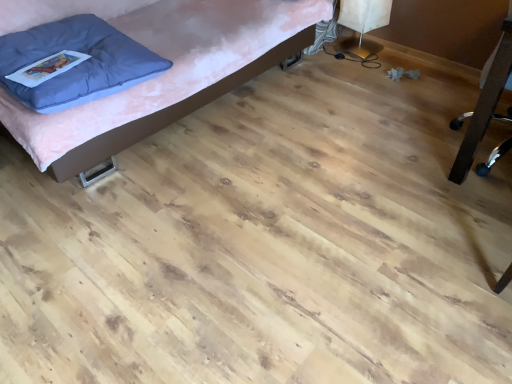
Where is `free area in between matte pink bed at upper left, which is the second furniture in right-to-left order, and black plastic chair at right, which ranks as the first furniture in right-to-left order`? This screenshot has height=384, width=512. free area in between matte pink bed at upper left, which is the second furniture in right-to-left order, and black plastic chair at right, which ranks as the first furniture in right-to-left order is located at coordinates 322,140.